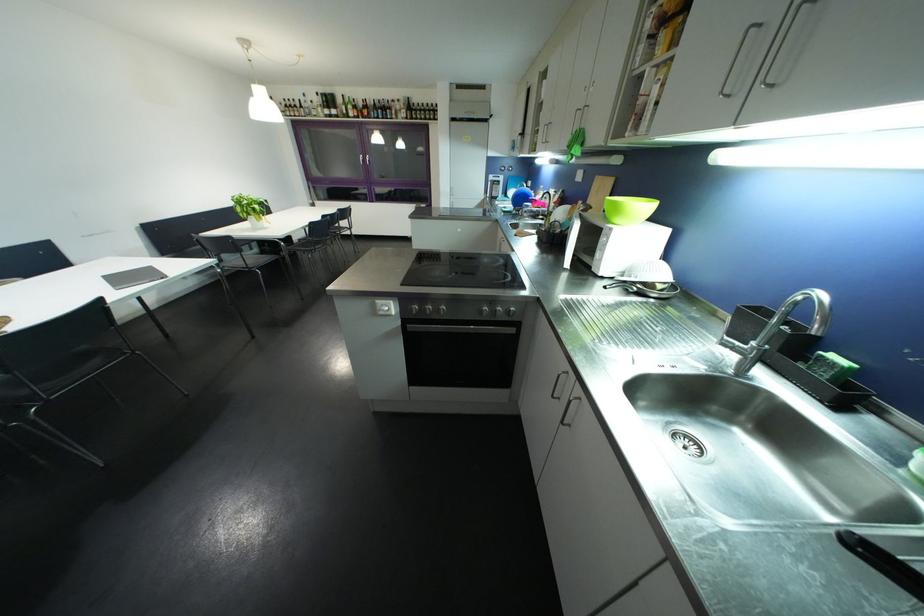
What do you see at coordinates (246, 261) in the screenshot? I see `a chair sitting surface` at bounding box center [246, 261].